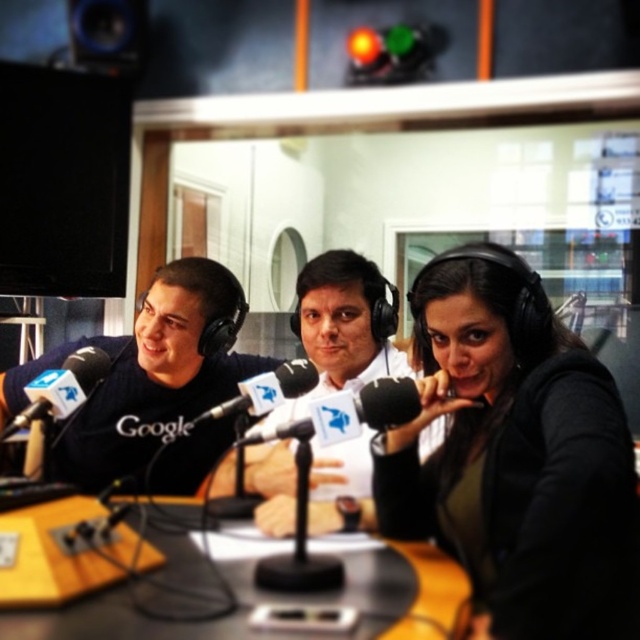
You are a technician setting up a camera for a podcast recording. The camera needs to be positioned exactly 36 inches away from the yellow wood table at center to ensure optimal framing. Based on the scene description, is the current camera placement correct?

The yellow wood table at center is 35.79 inches away from camera, which is just 0.21 inches less than the required 36 inches. The placement is almost correct but slightly closer than needed.

You are setting up a podcast recording session and need to place the black matte headphones at center and the black matte shirt at left on a shelf. Which item should you place first if you want to ensure both fit without rearrangement?

The black matte headphones at center is smaller than the black matte shirt at left, so you should place the larger item, the black matte shirt at left, first to ensure both fit without rearrangement.

Looking at this image, you are a technician in the studio and need to adjust the distance between the black matte headphones at center and the black matte shirt at left to 40 inches. Is the current distance sufficient? Please explain.

The current distance between the black matte headphones at center and the black matte shirt at left is 35.89 inches, which is less than the required 40 inches. Therefore, the technician needs to increase the distance to meet the requirement.